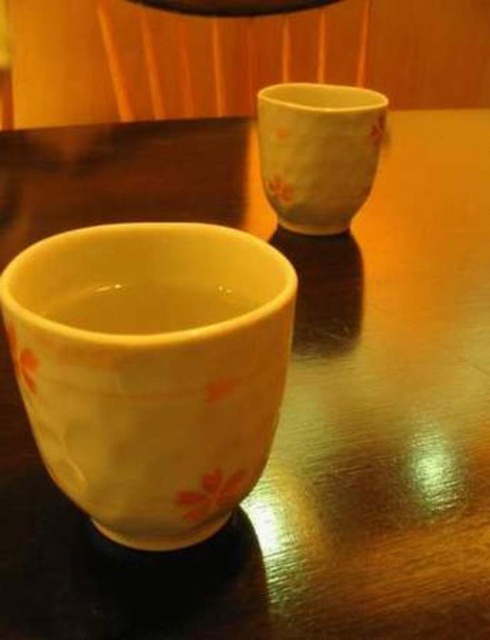
You are a delivery robot with a 12 inch wide package. You need to place it on the table between the yellow glazed cup at lower left and the matte ceramic cup at upper right. Can the package fit between them without touching either cup?

The distance between the yellow glazed cup at lower left and the matte ceramic cup at upper right is 11.81 inches. Since the package is 12 inches wide, it cannot fit between them without overlapping or touching the cups.

You are setting up a display for a pottery exhibition. You have two cups to place on a shelf. The yellow glazed cup at lower left and the matte ceramic cup at upper right. Which cup is shorter in height?

The yellow glazed cup at lower left is shorter in height compared to the matte ceramic cup at upper right.